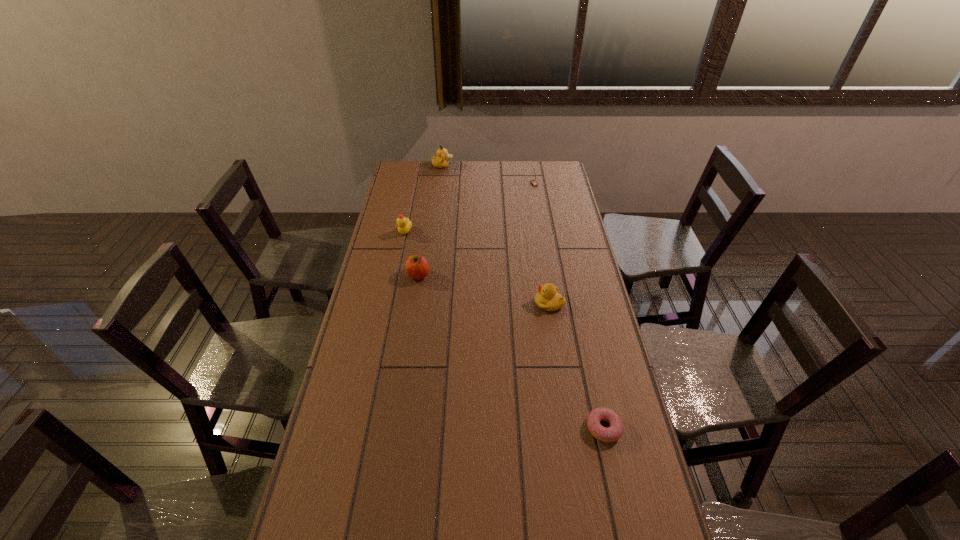
Locate an element on the screen. Image resolution: width=960 pixels, height=540 pixels. vacant area that lies between the fifth farthest object and the tallest object is located at coordinates (496, 234).

At what (x,y) coordinates should I click in order to perform the action: click on vacant space that is in between the apple and the leftmost duckling. Please return your answer as a coordinate pair (x, y). Image resolution: width=960 pixels, height=540 pixels. Looking at the image, I should click on (412, 254).

You are a GUI agent. You are given a task and a screenshot of the screen. Output one action in this format:
    pyautogui.click(x=<x>, y=<y>)
    Task: Click on the free space between the leftmost duckling and the nearest object
    
    Given the screenshot: What is the action you would take?
    pyautogui.click(x=504, y=330)

This screenshot has height=540, width=960. In order to click on empty space between the leftmost duckling and the rightmost duckling in this screenshot , I will do `click(477, 267)`.

Where is `free spot between the tallest object and the rightmost duckling`? free spot between the tallest object and the rightmost duckling is located at coordinates (496, 234).

The width and height of the screenshot is (960, 540). Identify the location of vacant space that's between the shortest object and the tallest object. (523, 297).

Locate an element on the screen. The height and width of the screenshot is (540, 960). free space between the fifth farthest object and the leftmost duckling is located at coordinates (477, 267).

The width and height of the screenshot is (960, 540). I want to click on free spot between the fourth farthest object and the leftmost object, so click(412, 254).

I want to click on free point between the fourth farthest object and the matchbox, so click(476, 230).

You are a GUI agent. You are given a task and a screenshot of the screen. Output one action in this format:
    pyautogui.click(x=<x>, y=<y>)
    Task: Click on the free space between the doughnut and the second nearest object
    
    Given the screenshot: What is the action you would take?
    pyautogui.click(x=576, y=366)